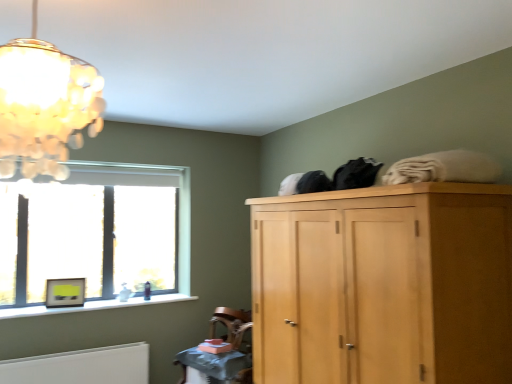
Question: From a real-world perspective, is wooden textured table at lower center physically located above or below clear glass window at left?

Choices:
 (A) below
 (B) above

Answer: (A)

Question: Is wooden textured table at lower center wider or thinner than clear glass window at left?

Choices:
 (A) wide
 (B) thin

Answer: (A)

Question: Estimate the real-world distances between objects in this image. Which object is closer to the translucent glass chandelier at upper left?

Choices:
 (A) light wood wardrobe at upper right
 (B) black fabric at top
 (C) clear glass window at left
 (D) matte yellow picture frame at window
 (E) wooden textured table at lower center

Answer: (B)

Question: Based on their relative distances, which object is farther from the black fabric at top?

Choices:
 (A) matte yellow picture frame at window
 (B) clear glass window at left
 (C) translucent glass chandelier at upper left
 (D) light wood wardrobe at upper right
 (E) wooden textured table at lower center

Answer: (A)